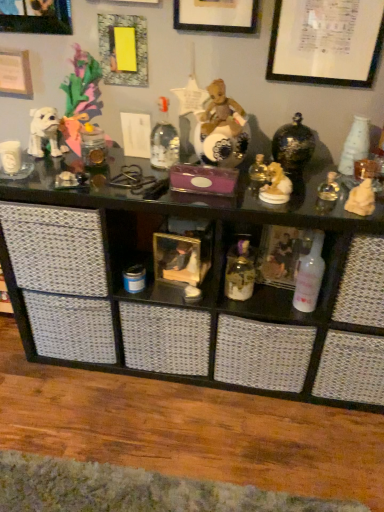
Question: Is gold ceramic dog at upper right, the 1th toy positioned from the left, outside of yellow paper at upper left, which is counted as the 3th picture frame, starting from the left?

Choices:
 (A) no
 (B) yes

Answer: (B)

Question: From a real-world perspective, is gold ceramic dog at upper right, the 1th toy positioned from the left, over yellow paper at upper left, which is counted as the 3th picture frame, starting from the left?

Choices:
 (A) yes
 (B) no

Answer: (B)

Question: From a real-world perspective, is gold ceramic dog at upper right, the 2th toy positioned from the right, beneath yellow paper at upper left, which is counted as the 3th picture frame, starting from the left?

Choices:
 (A) yes
 (B) no

Answer: (A)

Question: Is the position of gold ceramic dog at upper right, the 1th toy positioned from the left, more distant than that of yellow paper at upper left, which is counted as the 3th picture frame, starting from the left?

Choices:
 (A) no
 (B) yes

Answer: (A)

Question: Is gold ceramic dog at upper right, the 2th toy positioned from the right, facing towards yellow paper at upper left, which is counted as the 3th picture frame, starting from the left?

Choices:
 (A) yes
 (B) no

Answer: (B)

Question: From the image's perspective, is gold ceramic dog at upper right, the 1th toy positioned from the left, located beneath yellow paper at upper left, which is counted as the 3th picture frame, starting from the left?

Choices:
 (A) no
 (B) yes

Answer: (B)

Question: Would you consider light brown stone statue at right, marked as the first toy in a right-to-left arrangement, to be distant from black glass shelf at upper center, which is the first shelf from right to left?

Choices:
 (A) no
 (B) yes

Answer: (A)

Question: Does light brown stone statue at right, marked as the first toy in a right-to-left arrangement, lie behind black glass shelf at upper center, positioned as the second shelf in left-to-right order?

Choices:
 (A) no
 (B) yes

Answer: (B)

Question: Does light brown stone statue at right, the second toy viewed from the left, have a greater height compared to black glass shelf at upper center, which is the first shelf from right to left?

Choices:
 (A) yes
 (B) no

Answer: (B)

Question: From the image's perspective, would you say light brown stone statue at right, the second toy viewed from the left, is positioned over black glass shelf at upper center, positioned as the second shelf in left-to-right order?

Choices:
 (A) no
 (B) yes

Answer: (B)

Question: Considering the relative sizes of light brown stone statue at right, the second toy viewed from the left, and black glass shelf at upper center, positioned as the second shelf in left-to-right order, in the image provided, is light brown stone statue at right, the second toy viewed from the left, bigger than black glass shelf at upper center, positioned as the second shelf in left-to-right order,?

Choices:
 (A) no
 (B) yes

Answer: (A)

Question: Could you tell me if light brown stone statue at right, marked as the first toy in a right-to-left arrangement, is facing black glass shelf at upper center, positioned as the second shelf in left-to-right order?

Choices:
 (A) no
 (B) yes

Answer: (A)

Question: From a real-world perspective, is yellow paper at upper left, which is the third picture frame in right-to-left order, located higher than white paper at upper right, marked as the 1th picture frame in a right-to-left arrangement?

Choices:
 (A) no
 (B) yes

Answer: (A)